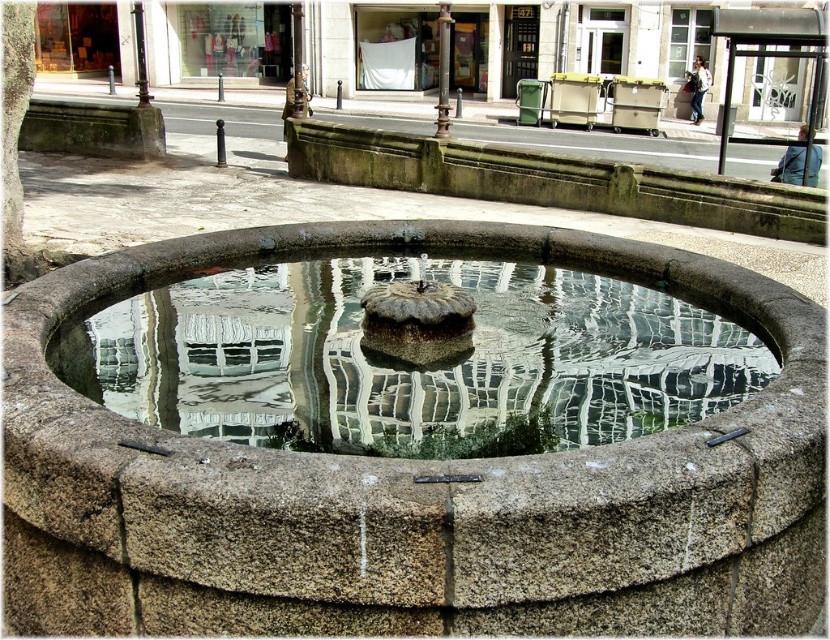
You are standing at the edge of the circular stone fountain in the plaza. You see the granite fountain at center and the clear glass water at center. Which object is positioned to the right of the other?

The granite fountain at center is to the right of clear glass water at center.

You are a maintenance worker needing to inspect the granite fountain at center and the clear glass water at center. Which object is positioned lower in the scene?

The granite fountain at center is located below clear glass water at center, so the granite fountain at center is positioned lower in the scene.

You are a maintenance worker tasked with cleaning the granite fountain at center and the clear glass water at center in the public square. Which object requires a larger cleaning area due to its size?

The granite fountain at center is larger in size than the clear glass water at center, so it requires a larger cleaning area.